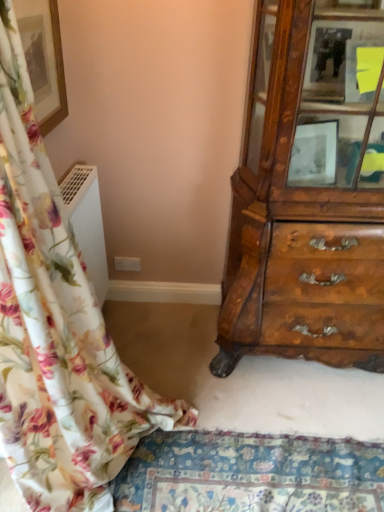
At what (x,y) coordinates should I click in order to perform the action: click on vacant space that is to the left of wooden cabinet at right. Please return your answer as a coordinate pair (x, y). Looking at the image, I should click on (172, 350).